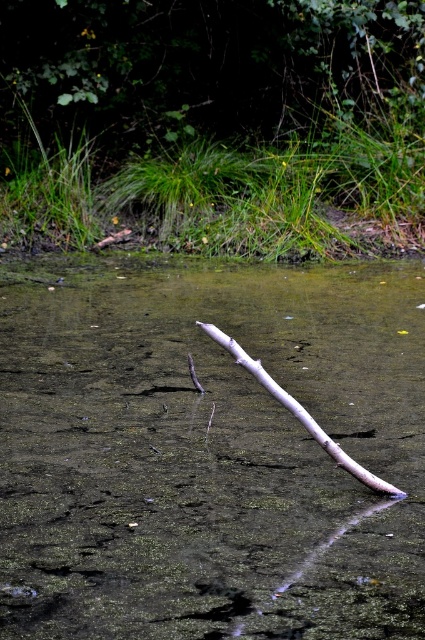
Between clear water at center and smooth gray stick at center, which one has more height?

Standing taller between the two is clear water at center.

Between point (184, 435) and point (260, 372), which one is positioned behind?

The point (184, 435) is more distant.

Where is `clear water at center`? This screenshot has height=640, width=425. clear water at center is located at coordinates (209, 451).